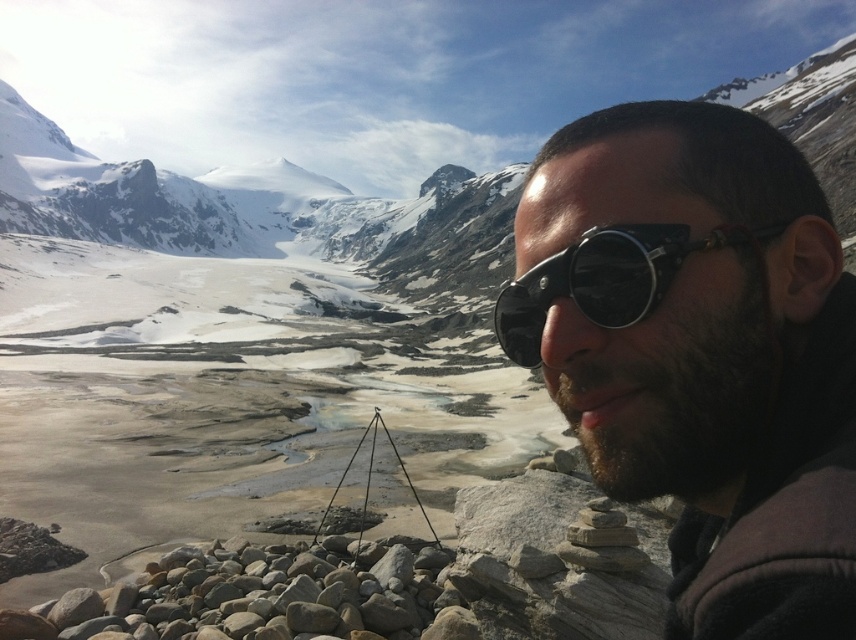
In the scene shown: You are a photographer setting up your equipment in the alpine landscape. You notice the point at coordinates (x=700, y=353) in the image. What object is located at that point?

The point at coordinates (x=700, y=353) corresponds to the matte black sunglasses at center.

You are standing at the camera position and looking at the alpine landscape. There are two points marked in the image. The first point is at coordinates point (667, 440) and the second is at point (645, 300). Which of these two points is closer to your current position?

Point (667, 440) is in front of point (645, 300), so it is closer to your current position.

You are a photographer preparing to capture the alpine landscape. You have two items in your kit, the matte black sunglasses at center and the black matte goggles at right. Which item should you choose if you need the larger one to protect your eyes from the bright sunlight?

The matte black sunglasses at center is bigger than the black matte goggles at right, so you should choose the matte black sunglasses at center for better eye protection against the bright sunlight.